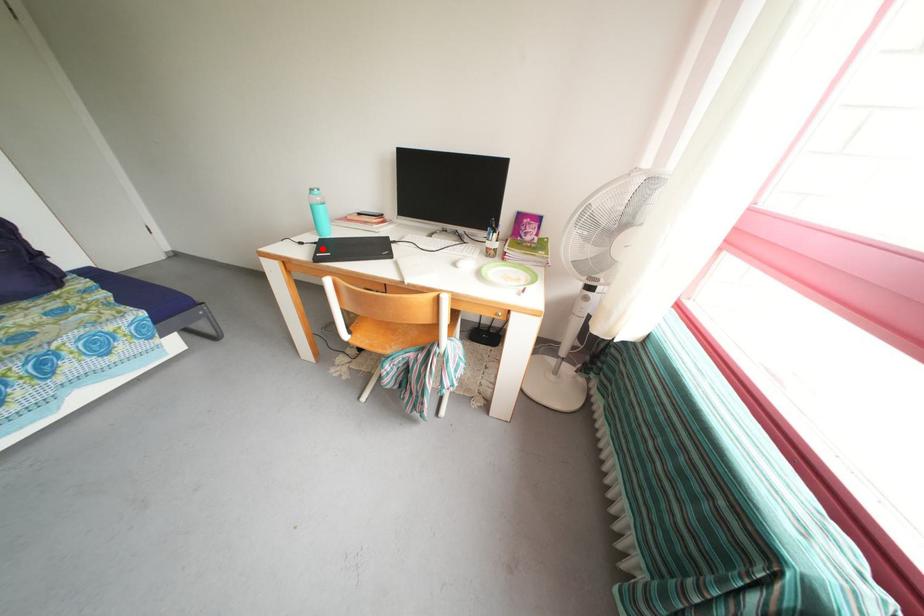
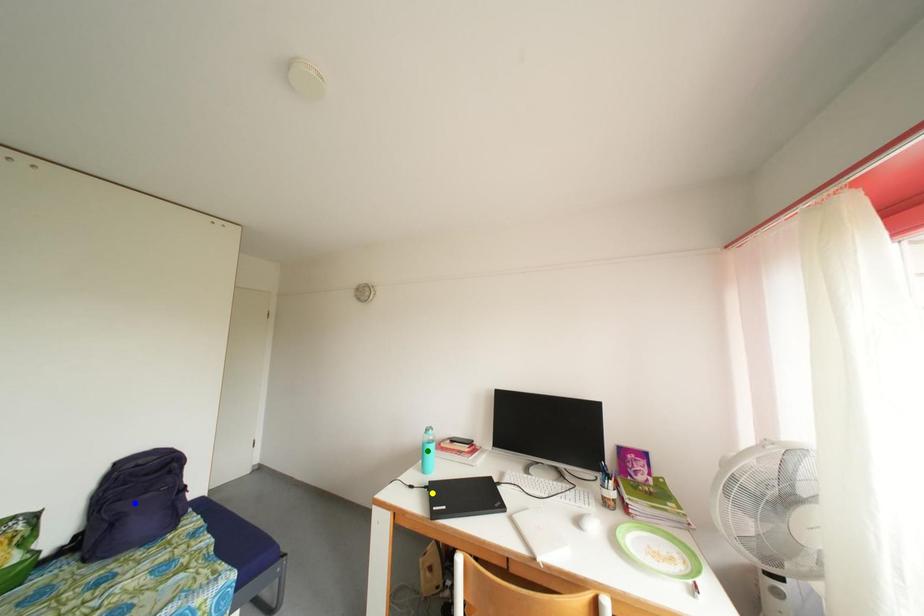
Question: I am providing you with two images of the same scene from different viewpoints. A red point is marked on the first image. You are given multiple points on the second image. In image 2, which mark is for the same physical point as the one in image 1?

Choices:
 (A) yellow point
 (B) blue point
 (C) green point

Answer: (A)